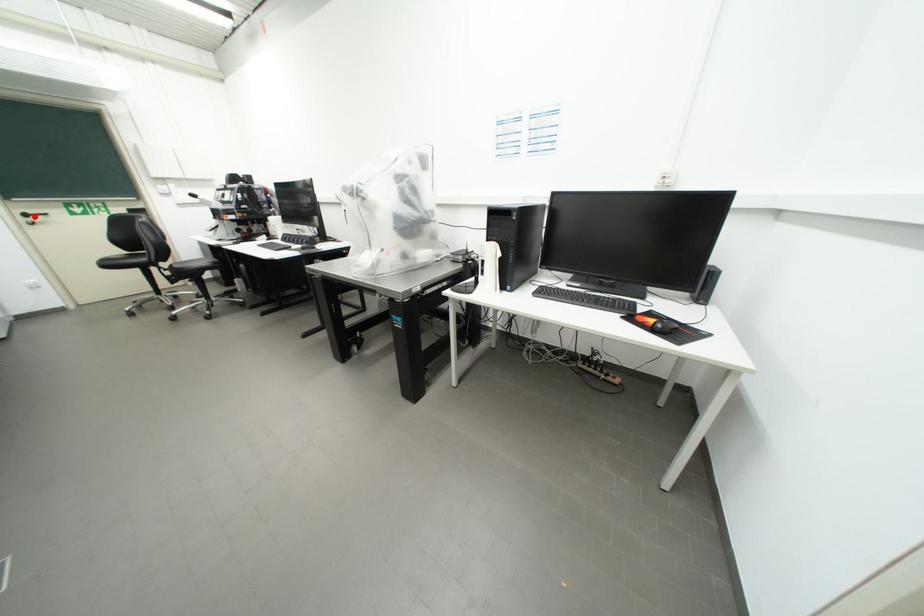
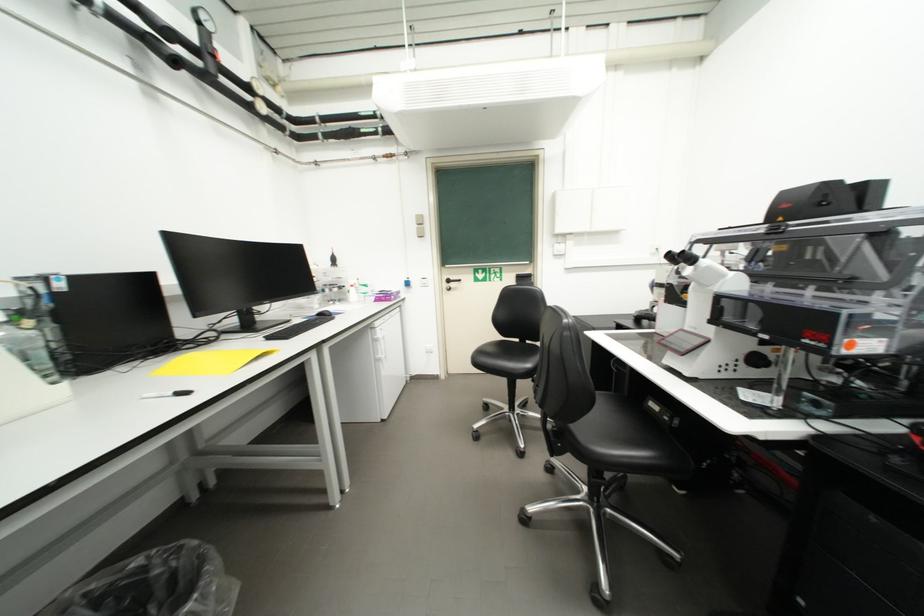
The point at the highlighted location is marked in the first image. Where is the corresponding point in the second image?

(456, 283)